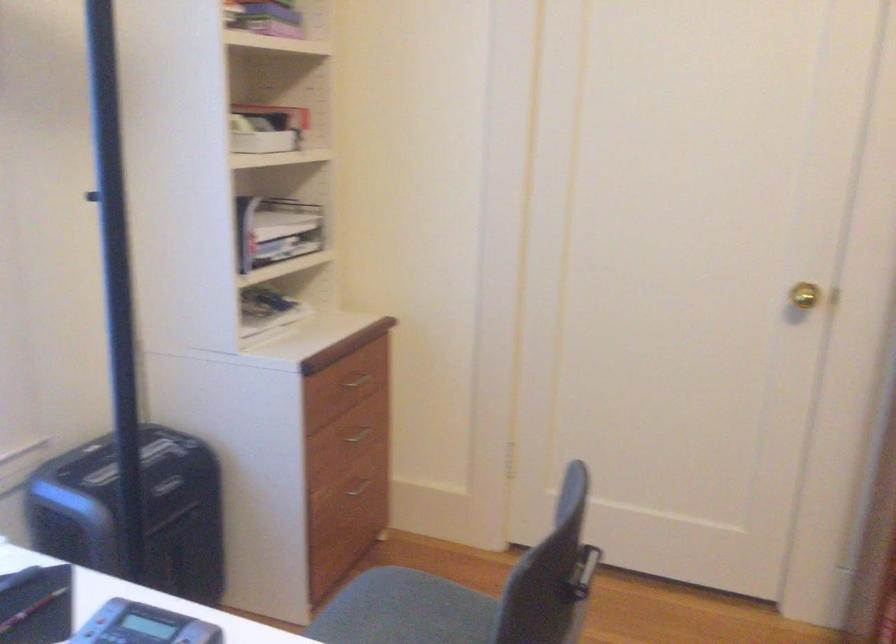
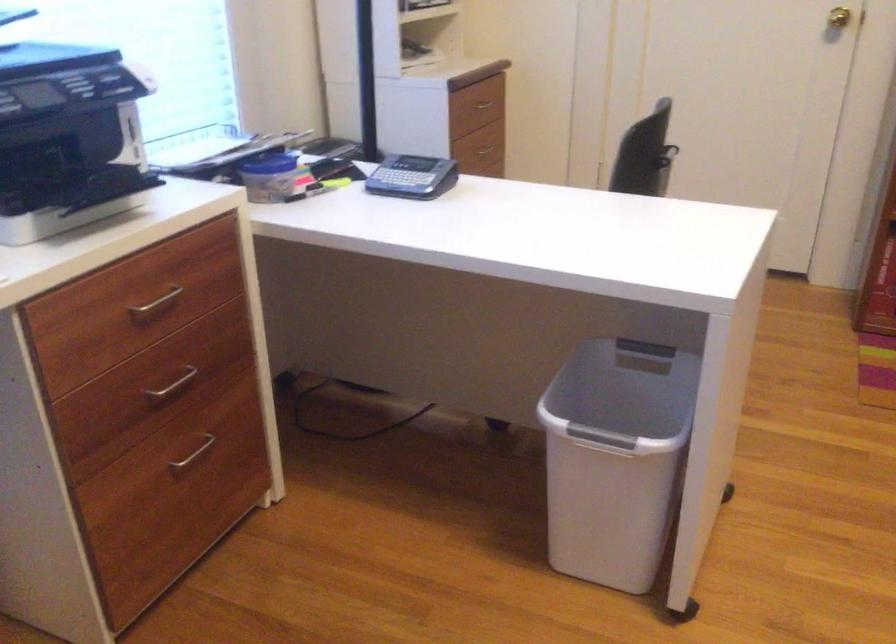
Find the pixel in the second image that matches point (364, 380) in the first image.

(484, 104)